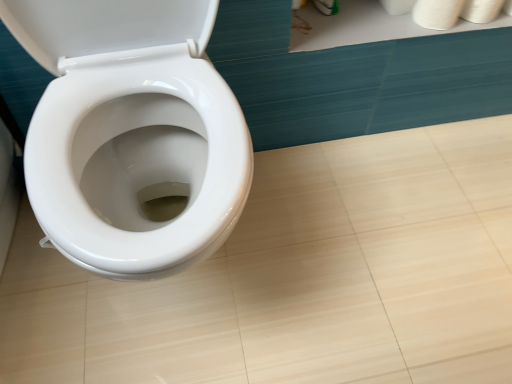
The height and width of the screenshot is (384, 512). What do you see at coordinates (437, 13) in the screenshot? I see `white matte toilet paper at upper right, marked as the second toilet paper in a right-to-left arrangement` at bounding box center [437, 13].

In order to face white matte toilet paper at upper right, the 1th toilet paper when ordered from left to right, should I rotate leftwards or rightwards?

You should rotate right by 17.780 degrees.

Where is `white matte toilet paper at upper right, acting as the 1th toilet paper starting from the right`? white matte toilet paper at upper right, acting as the 1th toilet paper starting from the right is located at coordinates (481, 10).

From a real-world perspective, which is physically below, white matte toilet paper at upper right, the third toilet paper viewed from the right, or white matte toilet paper at upper right, acting as the 1th toilet paper starting from the right?

From a 3D spatial view, white matte toilet paper at upper right, the third toilet paper viewed from the right, is below.

How many degrees apart are the facing directions of white matte toilet paper at upper right, the 1th toilet paper when ordered from left to right, and white matte toilet paper at upper right, acting as the 1th toilet paper starting from the right?

They differ by 0.000259 degrees in their facing directions.

Can you confirm if white matte toilet paper at upper right, the 1th toilet paper when ordered from left to right, is bigger than white matte toilet paper at upper right, acting as the 1th toilet paper starting from the right?

Incorrect, white matte toilet paper at upper right, the 1th toilet paper when ordered from left to right, is not larger than white matte toilet paper at upper right, acting as the 1th toilet paper starting from the right.

Is the surface of white matte toilet paper at upper right, the 1th toilet paper when ordered from left to right, in direct contact with white matte toilet paper at upper right, acting as the 1th toilet paper starting from the right?

There is a gap between white matte toilet paper at upper right, the 1th toilet paper when ordered from left to right, and white matte toilet paper at upper right, acting as the 1th toilet paper starting from the right.

Who is more distant, white matte toilet paper at upper right, marked as the second toilet paper in a right-to-left arrangement, or white matte toilet paper at upper right, the 3th toilet paper positioned from the left?

white matte toilet paper at upper right, the 3th toilet paper positioned from the left, is more distant.

Which of these two, white matte toilet paper at upper right, marked as the second toilet paper in a right-to-left arrangement, or white matte toilet paper at upper right, acting as the 1th toilet paper starting from the right, is smaller?

white matte toilet paper at upper right, marked as the second toilet paper in a right-to-left arrangement, is smaller.

Are white matte toilet paper at upper right, the 2th toilet paper viewed from the left, and white matte toilet paper at upper right, the 3th toilet paper positioned from the left, far apart?

No.

Choose the correct answer: Is white matte toilet paper at upper right, the 2th toilet paper viewed from the left, inside white matte toilet paper at upper right, the 1th toilet paper when ordered from left to right, or outside it?

The correct answer is: outside.

Is white matte toilet paper at upper right, the 1th toilet paper when ordered from left to right, at the back of white matte toilet paper at upper right, the 2th toilet paper viewed from the left?

No, white matte toilet paper at upper right, the 1th toilet paper when ordered from left to right, is not at the back of white matte toilet paper at upper right, the 2th toilet paper viewed from the left.

From the image's perspective, between white matte toilet paper at upper right, marked as the second toilet paper in a right-to-left arrangement, and white matte toilet paper at upper right, the 1th toilet paper when ordered from left to right, which one is located above?

white matte toilet paper at upper right, the 1th toilet paper when ordered from left to right, appears higher in the image.

Does white matte toilet paper at upper right, the 2th toilet paper viewed from the left, have a larger size compared to white matte toilet paper at upper right, the third toilet paper viewed from the right?

Correct, white matte toilet paper at upper right, the 2th toilet paper viewed from the left, is larger in size than white matte toilet paper at upper right, the third toilet paper viewed from the right.

Is white matte toilet paper at upper right, the 3th toilet paper positioned from the left, thinner than white matte toilet paper at upper right, the 1th toilet paper when ordered from left to right?

Correct, the width of white matte toilet paper at upper right, the 3th toilet paper positioned from the left, is less than that of white matte toilet paper at upper right, the 1th toilet paper when ordered from left to right.

Which point is more forward, (498, 12) or (391, 6)?

Point (498, 12)

Can you confirm if white matte toilet paper at upper right, acting as the 1th toilet paper starting from the right, is positioned to the right of white matte toilet paper at upper right, the 1th toilet paper when ordered from left to right?

Yes, white matte toilet paper at upper right, acting as the 1th toilet paper starting from the right, is to the right of white matte toilet paper at upper right, the 1th toilet paper when ordered from left to right.

Choose the correct answer: Is white matte toilet paper at upper right, the 3th toilet paper positioned from the left, inside white matte toilet paper at upper right, the 1th toilet paper when ordered from left to right, or outside it?

white matte toilet paper at upper right, the 3th toilet paper positioned from the left, cannot be found inside white matte toilet paper at upper right, the 1th toilet paper when ordered from left to right.

Measure the distance from white matte toilet paper at upper right, the 1th toilet paper when ordered from left to right, to white matte toilet paper at upper right, marked as the second toilet paper in a right-to-left arrangement.

white matte toilet paper at upper right, the 1th toilet paper when ordered from left to right, and white matte toilet paper at upper right, marked as the second toilet paper in a right-to-left arrangement, are 6.59 centimeters apart.

Does point (405, 7) come closer to viewer compared to point (423, 12)?

No, it is not.

From the image's perspective, relative to white matte toilet paper at upper right, the 2th toilet paper viewed from the left, is white matte toilet paper at upper right, the 1th toilet paper when ordered from left to right, above or below?

white matte toilet paper at upper right, the 1th toilet paper when ordered from left to right, is situated higher than white matte toilet paper at upper right, the 2th toilet paper viewed from the left, in the image.

Is white matte toilet paper at upper right, the 1th toilet paper when ordered from left to right, far from white matte toilet paper at upper right, the 2th toilet paper viewed from the left?

white matte toilet paper at upper right, the 1th toilet paper when ordered from left to right, is near white matte toilet paper at upper right, the 2th toilet paper viewed from the left, not far away.

Does white matte toilet paper at upper right, acting as the 1th toilet paper starting from the right, come behind white matte toilet paper at upper right, the 2th toilet paper viewed from the left?

Yes, white matte toilet paper at upper right, acting as the 1th toilet paper starting from the right, is behind white matte toilet paper at upper right, the 2th toilet paper viewed from the left.

From a real-world perspective, relative to white matte toilet paper at upper right, marked as the second toilet paper in a right-to-left arrangement, is white matte toilet paper at upper right, the 3th toilet paper positioned from the left, vertically above or below?

In terms of real-world spatial position, white matte toilet paper at upper right, the 3th toilet paper positioned from the left, is below white matte toilet paper at upper right, marked as the second toilet paper in a right-to-left arrangement.

Can you see white matte toilet paper at upper right, the 3th toilet paper positioned from the left, touching white matte toilet paper at upper right, marked as the second toilet paper in a right-to-left arrangement?

Yes.

Who is smaller, white matte toilet paper at upper right, the 3th toilet paper positioned from the left, or white matte toilet paper at upper right, marked as the second toilet paper in a right-to-left arrangement?

white matte toilet paper at upper right, marked as the second toilet paper in a right-to-left arrangement.

Locate an element on the screen. This screenshot has width=512, height=384. toilet paper that is the 1st one when counting downward from the white matte toilet paper at upper right, the third toilet paper viewed from the right (from the image's perspective) is located at coordinates (481, 10).

At what (x,y) coordinates should I click in order to perform the action: click on toilet paper that is on the right side of white matte toilet paper at upper right, marked as the second toilet paper in a right-to-left arrangement. Please return your answer as a coordinate pair (x, y). This screenshot has width=512, height=384. Looking at the image, I should click on (481, 10).

Which object lies nearer to the anchor point white matte toilet paper at upper right, the 1th toilet paper when ordered from left to right, white matte toilet paper at upper right, the 3th toilet paper positioned from the left, or white matte toilet paper at upper right, the 2th toilet paper viewed from the left?

white matte toilet paper at upper right, the 2th toilet paper viewed from the left, is positioned closer to the anchor white matte toilet paper at upper right, the 1th toilet paper when ordered from left to right.

When comparing their distances from white matte toilet paper at upper right, the 3th toilet paper positioned from the left, does white matte toilet paper at upper right, the 2th toilet paper viewed from the left, or white matte toilet paper at upper right, the third toilet paper viewed from the right, seem closer?

white matte toilet paper at upper right, the 2th toilet paper viewed from the left, lies closer to white matte toilet paper at upper right, the 3th toilet paper positioned from the left, than the other object.

From the image, which object appears to be farther from white matte toilet paper at upper right, marked as the second toilet paper in a right-to-left arrangement, white matte toilet paper at upper right, the 1th toilet paper when ordered from left to right, or white matte toilet paper at upper right, acting as the 1th toilet paper starting from the right?

white matte toilet paper at upper right, the 1th toilet paper when ordered from left to right, is further to white matte toilet paper at upper right, marked as the second toilet paper in a right-to-left arrangement.

Which object lies nearer to the anchor point white matte toilet paper at upper right, marked as the second toilet paper in a right-to-left arrangement, white matte toilet paper at upper right, acting as the 1th toilet paper starting from the right, or white matte toilet paper at upper right, the 1th toilet paper when ordered from left to right?

white matte toilet paper at upper right, acting as the 1th toilet paper starting from the right.

When comparing their distances from white matte toilet paper at upper right, the third toilet paper viewed from the right, does white matte toilet paper at upper right, marked as the second toilet paper in a right-to-left arrangement, or white matte toilet paper at upper right, acting as the 1th toilet paper starting from the right, seem closer?

white matte toilet paper at upper right, marked as the second toilet paper in a right-to-left arrangement, is positioned closer to the anchor white matte toilet paper at upper right, the third toilet paper viewed from the right.

Considering their positions, is white matte toilet paper at upper right, the 1th toilet paper when ordered from left to right, positioned closer to white matte toilet paper at upper right, the 3th toilet paper positioned from the left, than white matte toilet paper at upper right, marked as the second toilet paper in a right-to-left arrangement?

white matte toilet paper at upper right, marked as the second toilet paper in a right-to-left arrangement, is closer to white matte toilet paper at upper right, the 3th toilet paper positioned from the left.

Locate an element on the screen. The image size is (512, 384). toilet paper located between white matte toilet paper at upper right, the third toilet paper viewed from the right, and white matte toilet paper at upper right, the 3th toilet paper positioned from the left, in the left-right direction is located at coordinates (437, 13).